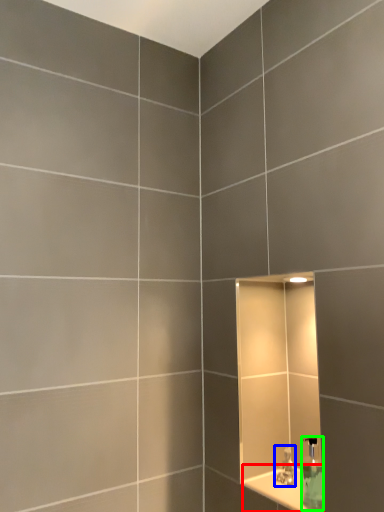
Question: Based on their relative distances, which object is nearer to ledge (highlighted by a red box)? Choose from tap (highlighted by a blue box) and soap dispenser (highlighted by a green box).

Choices:
 (A) tap
 (B) soap dispenser

Answer: (A)